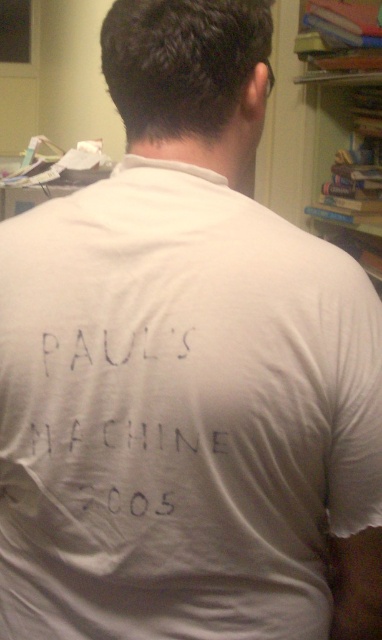
You need to determine if the white fabric text at back can fit on the wooden bookshelf at upper right. Based on the scene, can the text fit horizontally on the shelf?

The white fabric text at back has a width less than the wooden bookshelf at upper right, so it can fit horizontally on the shelf.

You are organizing a small event in the room and need to ensure the text on the white fabric is visible to all attendees. Considering the current setup, will the wooden bookshelf at upper right block the view of the white fabric text at back?

The white fabric text at back is in front of the wooden bookshelf at upper right, so the bookshelf will not block the view of the text. The text should be visible to attendees as it is positioned in front of the bookshelf.

You are a delivery person who needs to place a box that is 1.5 meters long between the white fabric text at back and the wooden bookshelf at upper right. Is there enough space to fit the box horizontally between them?

The distance between the white fabric text at back and the wooden bookshelf at upper right is 1.62 meters. Since the box is 1.5 meters long, there is enough space to fit it horizontally between them as the available space is slightly larger than the box.